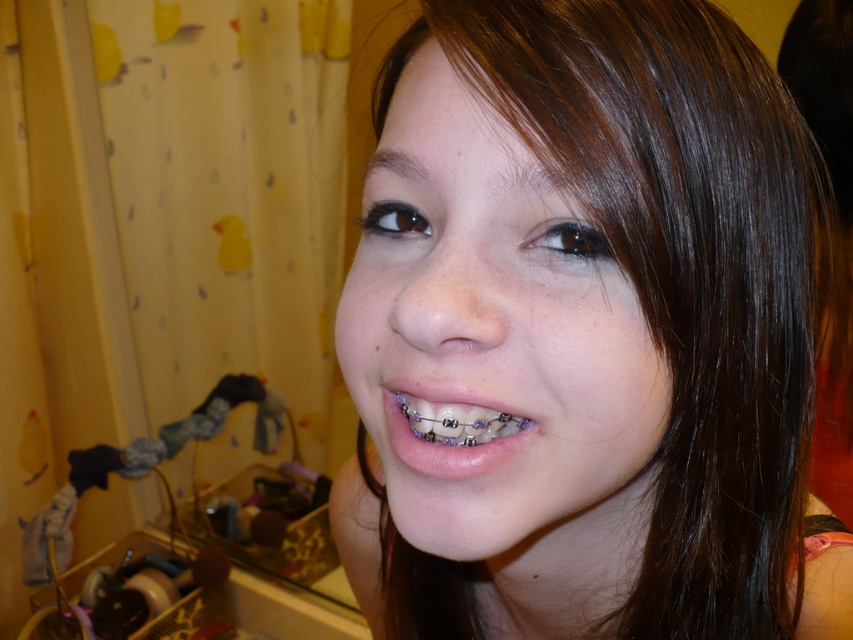
Question: Is smooth skin face at center closer to camera compared to purple metallic braces at center?

Choices:
 (A) no
 (B) yes

Answer: (B)

Question: Which point is farther from the camera taking this photo?

Choices:
 (A) (479, 444)
 (B) (364, 209)

Answer: (B)

Question: Does smooth skin face at center appear under purple metallic braces at center?

Choices:
 (A) yes
 (B) no

Answer: (A)

Question: Does smooth skin face at center appear on the right side of purple metallic braces at center?

Choices:
 (A) no
 (B) yes

Answer: (B)